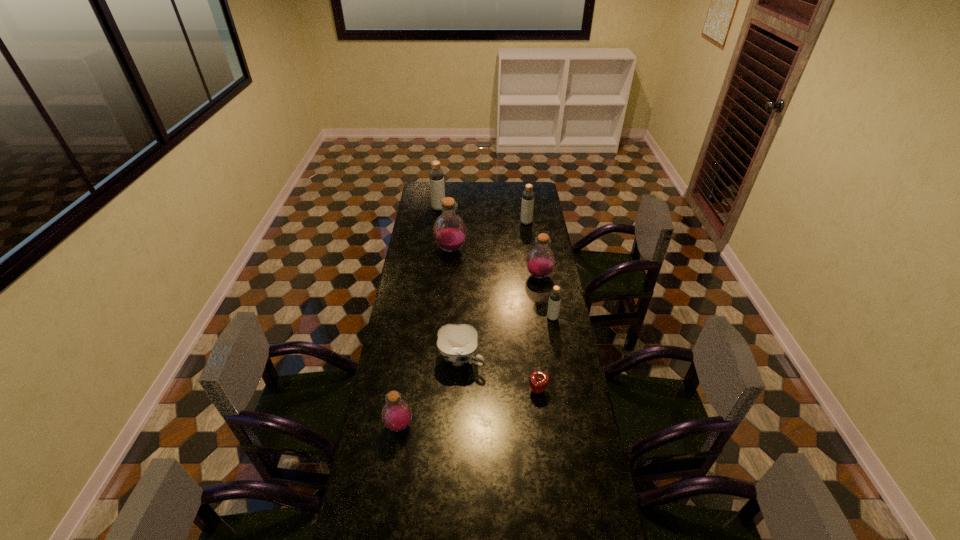
Where is `vacant space situated 0.070m on the left of the smallest gray bottle`? Image resolution: width=960 pixels, height=540 pixels. vacant space situated 0.070m on the left of the smallest gray bottle is located at coordinates (531, 318).

You are a GUI agent. You are given a task and a screenshot of the screen. Output one action in this format:
    pyautogui.click(x=<x>, y=<y>)
    Task: Click on the blank space located 0.220m on the back of the nearest bottle
    
    Given the screenshot: What is the action you would take?
    pyautogui.click(x=409, y=363)

Where is `vacant space located 0.170m on the left of the chinaware`? vacant space located 0.170m on the left of the chinaware is located at coordinates (396, 359).

Locate an element on the screen. The height and width of the screenshot is (540, 960). vacant space positioned 0.080m on the back of the second nearest object is located at coordinates (535, 366).

Find the location of a particular element. This screenshot has height=540, width=960. apple located in the right edge section of the desktop is located at coordinates pyautogui.click(x=538, y=381).

In order to click on free space at the far edge in this screenshot , I will do tap(458, 191).

The height and width of the screenshot is (540, 960). What are the coordinates of `blank space at the left edge of the desktop` in the screenshot? It's located at (415, 259).

I want to click on free region at the right edge of the desktop, so click(x=590, y=476).

The width and height of the screenshot is (960, 540). In order to click on free space at the far right corner of the desktop in this screenshot , I will do `click(524, 183)`.

This screenshot has width=960, height=540. Find the location of `vacant space that's between the fifth nearest bottle and the biggest purple bottle`. vacant space that's between the fifth nearest bottle and the biggest purple bottle is located at coordinates (x=489, y=236).